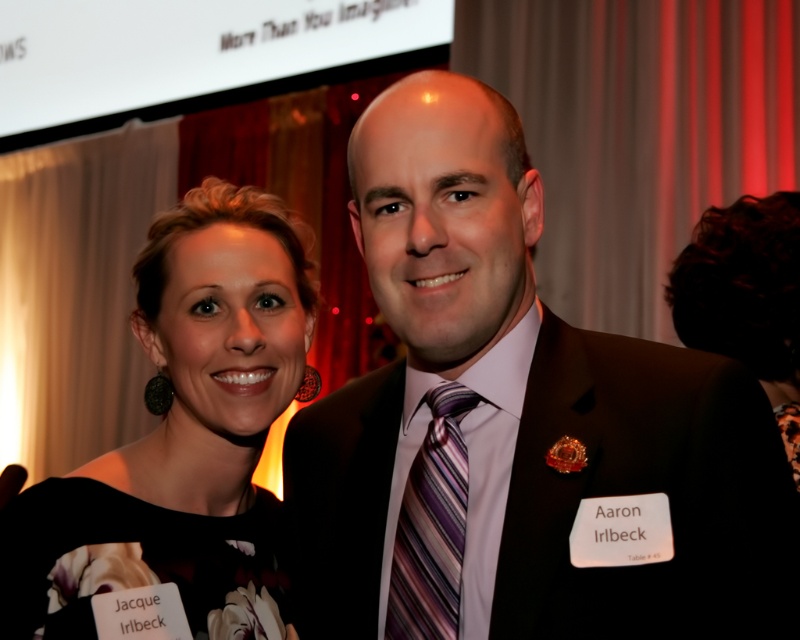
Between matte black suit at center and black floral dress at center, which one is positioned lower?

matte black suit at center

Does matte black suit at center lie in front of black floral dress at center?

Yes, matte black suit at center is closer to the viewer.

Between point (692, 604) and point (189, 422), which one is positioned behind?

Point (189, 422)

Image resolution: width=800 pixels, height=640 pixels. I want to click on matte black suit at center, so click(x=520, y=428).

Is point (17, 573) positioned after point (422, 616)?

Yes, it is.

Between black floral dress at center and striped silk tie at center, which one appears on the left side from the viewer's perspective?

Positioned to the left is black floral dress at center.

Does point (226, 237) come closer to viewer compared to point (458, 397)?

No, (226, 237) is behind (458, 397).

Locate an element on the screen. This screenshot has height=640, width=800. black floral dress at center is located at coordinates (180, 445).

Is matte black suit at center thinner than striped silk tie at center?

No, matte black suit at center is not thinner than striped silk tie at center.

Does point (416, 170) come in front of point (450, 595)?

Yes, point (416, 170) is in front of point (450, 595).

Where is `matte black suit at center`? matte black suit at center is located at coordinates (520, 428).